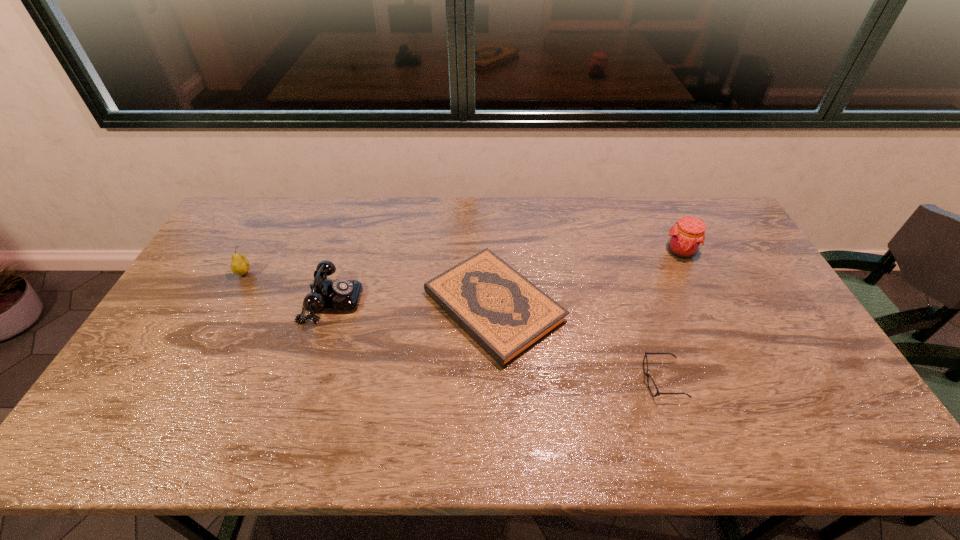
Identify the location of free space between the pear and the third object from right to left. (370, 290).

Locate an element on the screen. vacant region between the pear and the third object from right to left is located at coordinates (370, 290).

Find the location of a particular element. This screenshot has height=540, width=960. vacant point located between the rightmost object and the hardback book is located at coordinates (588, 279).

Locate an element on the screen. blank region between the third object from right to left and the fourth object from right to left is located at coordinates (413, 304).

Image resolution: width=960 pixels, height=540 pixels. In order to click on free space between the hardback book and the telephone in this screenshot , I will do coord(413,304).

At what (x,y) coordinates should I click in order to perform the action: click on free space between the third object from right to left and the tallest object. Please return your answer as a coordinate pair (x, y). Image resolution: width=960 pixels, height=540 pixels. Looking at the image, I should click on (588, 279).

The image size is (960, 540). In order to click on free space between the hardback book and the second object from right to left in this screenshot , I will do `click(578, 344)`.

Where is `object that can be found as the third closest to the second object from left to right`? This screenshot has height=540, width=960. object that can be found as the third closest to the second object from left to right is located at coordinates (658, 393).

Point out which object is positioned as the fourth nearest to the leftmost object. Please provide its 2D coordinates. Your answer should be formatted as a tuple, i.e. [(x, y)], where the tuple contains the x and y coordinates of a point satisfying the conditions above.

[(688, 234)]

Image resolution: width=960 pixels, height=540 pixels. Identify the location of vacant space that satisfies the following two spatial constraints: 1. on the dial of the telephone; 2. on the left side of the third object from right to left. click(x=329, y=307).